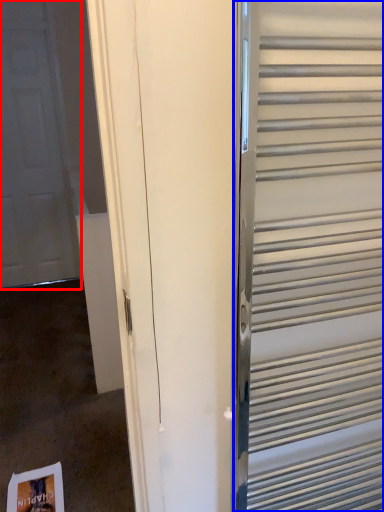
Question: Among these objects, which one is nearest to the camera, door (highlighted by a red box) or elevator (highlighted by a blue box)?

Choices:
 (A) door
 (B) elevator

Answer: (B)